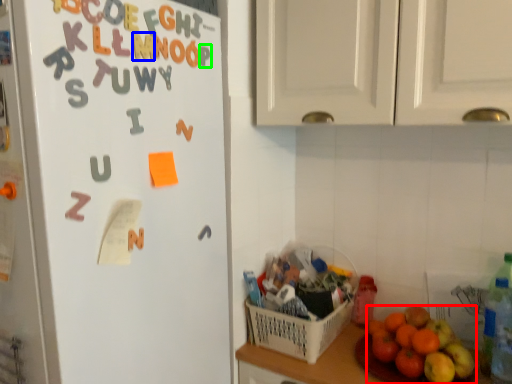
Question: Considering the real-world distances, which object is closest to grapefruit (highlighted by a red box)? alphabet (highlighted by a blue box) or letter (highlighted by a green box).

Choices:
 (A) alphabet
 (B) letter

Answer: (B)